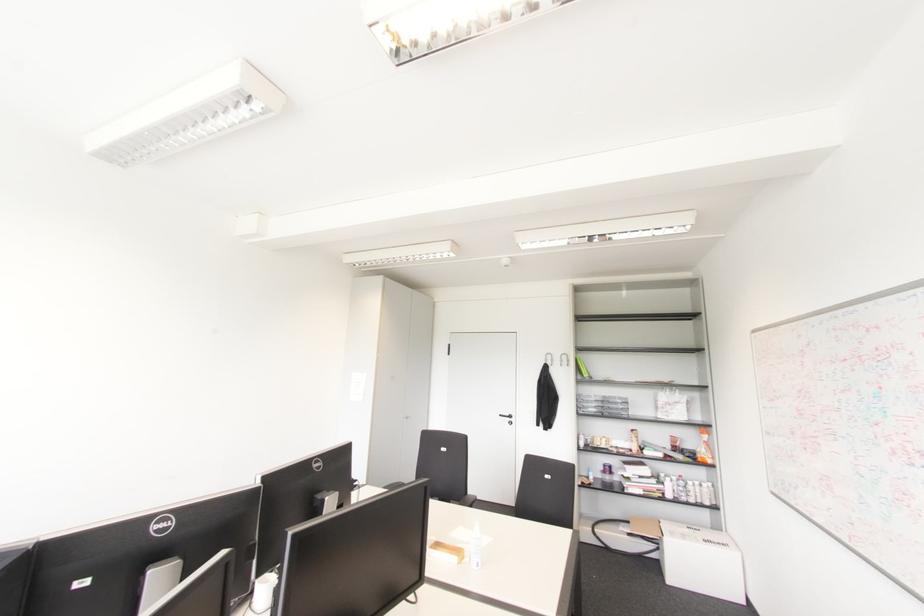
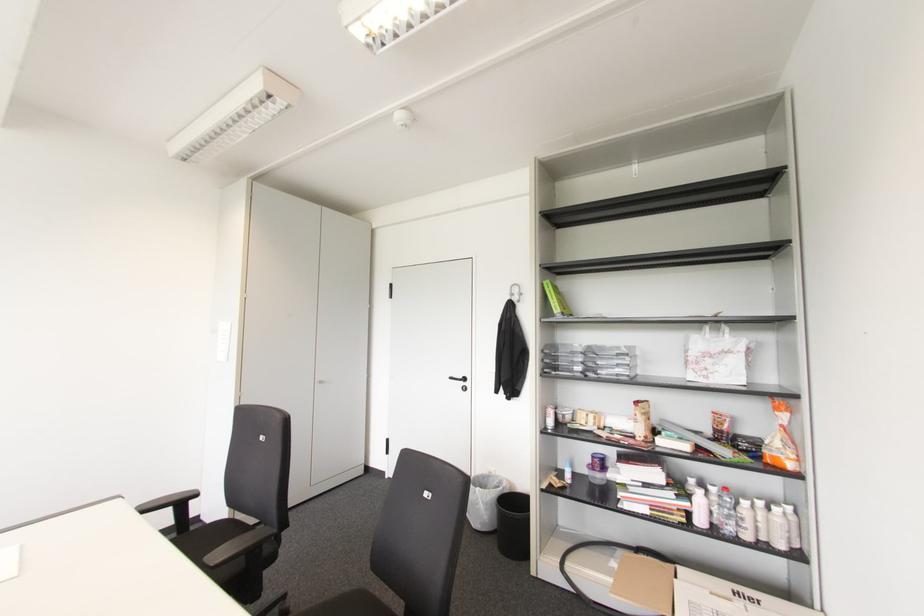
Where in the second image is the point corresponding to (x=509, y=416) from the first image?

(464, 379)